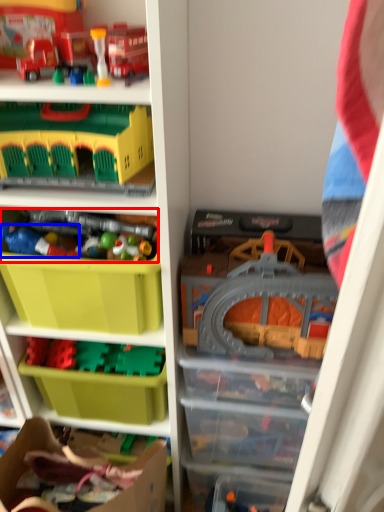
Question: Which of the following is the closest to the observer, toy (highlighted by a red box) or toy (highlighted by a blue box)?

Choices:
 (A) toy
 (B) toy

Answer: (B)